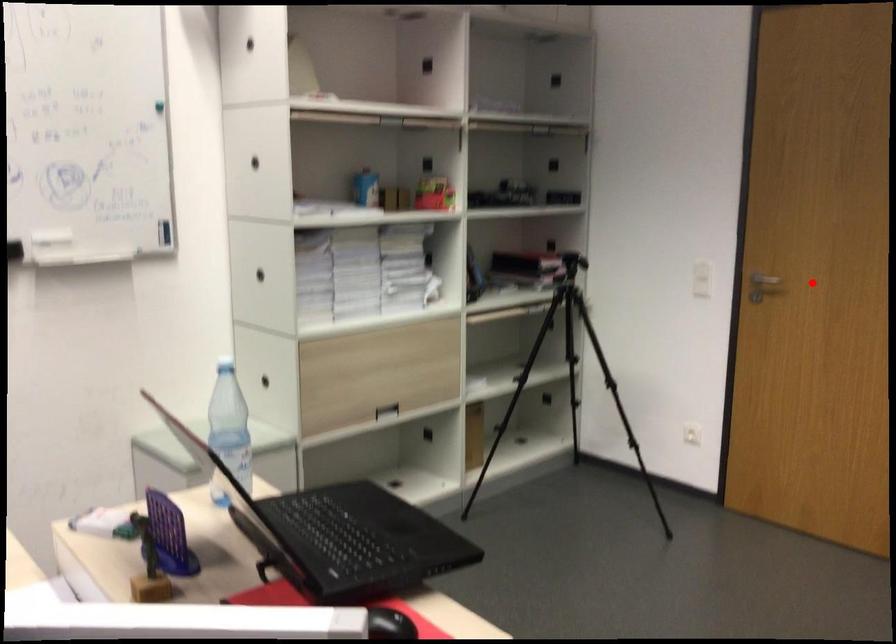
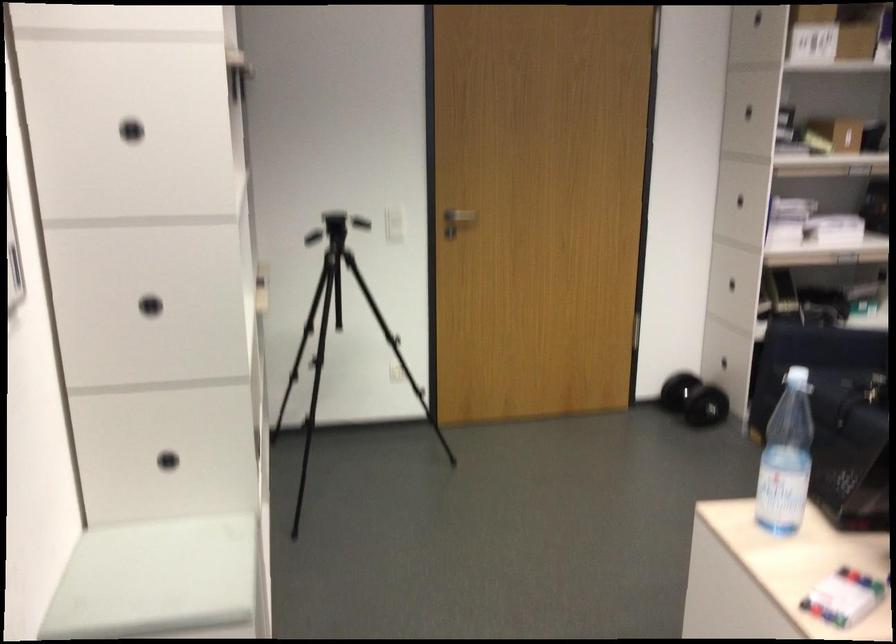
Question: I am providing you with two images of the same scene from different viewpoints. Image1 has a red point marked. In image2, the corresponding 3D location appears at what relative position? Reply with the corresponding letter.

Choices:
 (A) Closer
 (B) Farther

Answer: (B)